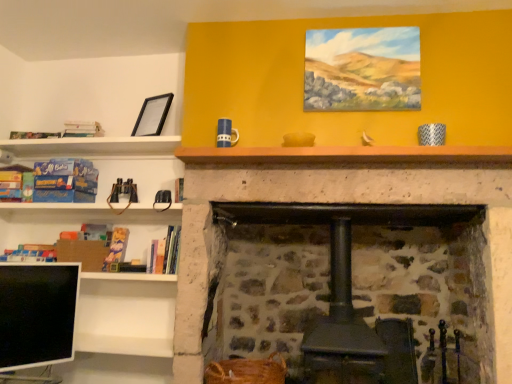
Question: Considering the relative positions of hardcover book at center, the 6th book from the left, and matte blue book at left, which is the 1th book from left to right, in the image provided, is hardcover book at center, the 6th book from the left, in front of matte blue book at left, which is the 1th book from left to right,?

Choices:
 (A) no
 (B) yes

Answer: (B)

Question: Is hardcover book at center, the 2th book viewed from the right, outside matte blue book at left, which appears as the seventh book when viewed from the right?

Choices:
 (A) yes
 (B) no

Answer: (A)

Question: From a real-world perspective, is hardcover book at center, the 6th book from the left, over matte blue book at left, which appears as the seventh book when viewed from the right?

Choices:
 (A) no
 (B) yes

Answer: (A)

Question: Can you confirm if hardcover book at center, the 2th book viewed from the right, is thinner than matte blue book at left, which appears as the seventh book when viewed from the right?

Choices:
 (A) yes
 (B) no

Answer: (A)

Question: Is hardcover book at center, the 2th book viewed from the right, far from matte blue book at left, which is the 1th book from left to right?

Choices:
 (A) no
 (B) yes

Answer: (A)

Question: Are hardcover book at center, the 6th book from the left, and matte blue book at left, which is the 1th book from left to right, making contact?

Choices:
 (A) yes
 (B) no

Answer: (B)

Question: Considering the relative sizes of brown woven basket at lower center and hardcover book at left, the 5th book positioned from the left, in the image provided, is brown woven basket at lower center taller than hardcover book at left, the 5th book positioned from the left,?

Choices:
 (A) no
 (B) yes

Answer: (A)

Question: From the image's perspective, would you say brown woven basket at lower center is shown under hardcover book at left, the 3th book positioned from the right?

Choices:
 (A) no
 (B) yes

Answer: (B)

Question: Considering the relative positions of brown woven basket at lower center and hardcover book at left, the 5th book positioned from the left, in the image provided, is brown woven basket at lower center to the right of hardcover book at left, the 5th book positioned from the left, from the viewer's perspective?

Choices:
 (A) no
 (B) yes

Answer: (B)

Question: Does brown woven basket at lower center have a smaller size compared to hardcover book at left, the 3th book positioned from the right?

Choices:
 (A) no
 (B) yes

Answer: (A)

Question: From a real-world perspective, does brown woven basket at lower center sit lower than hardcover book at left, the 3th book positioned from the right?

Choices:
 (A) yes
 (B) no

Answer: (A)

Question: Is brown woven basket at lower center outside of hardcover book at left, the 5th book positioned from the left?

Choices:
 (A) yes
 (B) no

Answer: (A)

Question: Is hardcover book at left, the first book when ordered from right to left, turned away from hardcover book at left, which appears as the 6th book when viewed from the right?

Choices:
 (A) no
 (B) yes

Answer: (A)